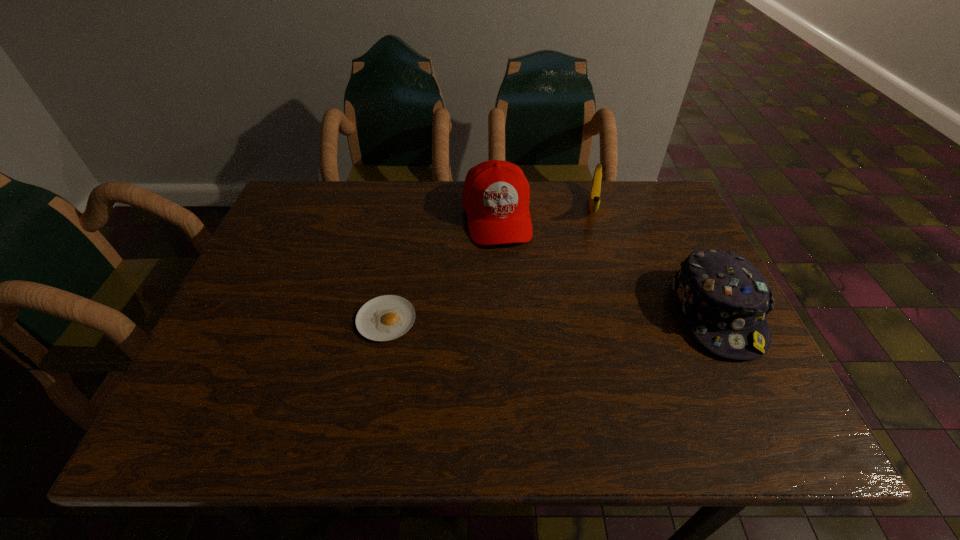
The image size is (960, 540). In order to click on vacant region located 0.250m on the front panel of the second object from left to right in this screenshot , I will do `click(516, 327)`.

You are a GUI agent. You are given a task and a screenshot of the screen. Output one action in this format:
    pyautogui.click(x=<x>, y=<y>)
    Task: Click on the vacant space located 0.210m on the front panel of the second object from left to right
    The width and height of the screenshot is (960, 540).
    Given the screenshot: What is the action you would take?
    pyautogui.click(x=514, y=313)

In order to click on vacant space located on the front panel of the second object from left to right in this screenshot , I will do pyautogui.click(x=506, y=272).

Identify the location of vacant region located at the stem of the banana. (594, 252).

Find the location of `free space located at the stem of the banana`. free space located at the stem of the banana is located at coordinates (588, 320).

At what (x,y) coordinates should I click in order to perform the action: click on vacant space located at the stem of the banana. Please return your answer as a coordinate pair (x, y). The image size is (960, 540). Looking at the image, I should click on (593, 271).

You are a GUI agent. You are given a task and a screenshot of the screen. Output one action in this format:
    pyautogui.click(x=<x>, y=<y>)
    Task: Click on the baseball cap that is at the far edge
    The image size is (960, 540).
    Given the screenshot: What is the action you would take?
    (496, 193)

Find the location of a particular element. This screenshot has height=540, width=960. banana that is at the far edge is located at coordinates (594, 201).

Where is `object situated at the near edge`? object situated at the near edge is located at coordinates (725, 299).

Identify the location of object that is at the right edge. (725, 299).